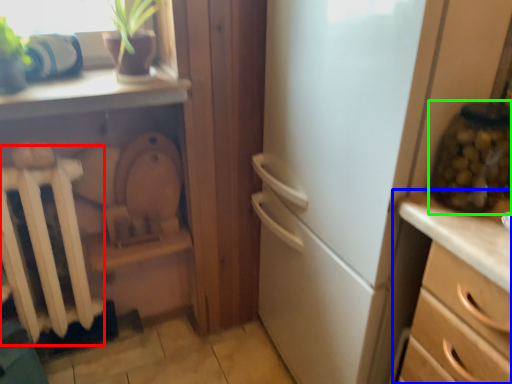
Question: Estimate the real-world distances between objects in this image. Which object is farther from radiator (highlighted by a red box), chest of drawers (highlighted by a blue box) or glass jar (highlighted by a green box)?

Choices:
 (A) chest of drawers
 (B) glass jar

Answer: (B)